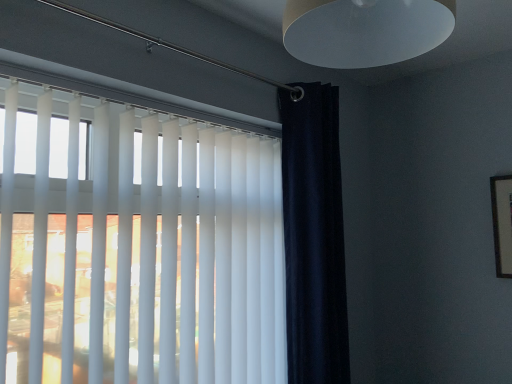
Question: Is matte white lampshade at upper center spatially inside white matte blinds at upper left, or outside of it?

Choices:
 (A) outside
 (B) inside

Answer: (A)

Question: From their relative heights in the image, would you say matte white lampshade at upper center is taller or shorter than white matte blinds at upper left?

Choices:
 (A) tall
 (B) short

Answer: (B)

Question: Which is nearer to the white matte blinds at upper left?

Choices:
 (A) navy blue velvet curtain at right
 (B) matte white lampshade at upper center

Answer: (A)

Question: Considering the real-world distances, which object is farthest from the white matte blinds at upper left?

Choices:
 (A) matte white lampshade at upper center
 (B) navy blue velvet curtain at right

Answer: (A)